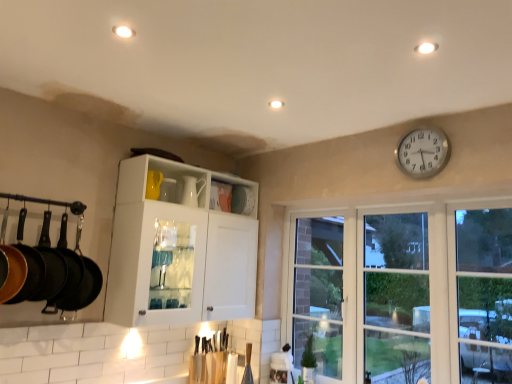
Question: Can you confirm if black cast iron frying pan at left, positioned as the first frying pan in back-to-front order, is thinner than matte black frying pan at left, which ranks as the 2th frying pan in back-to-front order?

Choices:
 (A) no
 (B) yes

Answer: (A)

Question: From the image's perspective, is black cast iron frying pan at left, positioned as the first frying pan in back-to-front order, on matte black frying pan at left, which ranks as the 2th frying pan in back-to-front order?

Choices:
 (A) no
 (B) yes

Answer: (A)

Question: From the image's perspective, is black cast iron frying pan at left, positioned as the 4th frying pan in front-to-back order, under matte black frying pan at left, the 3th frying pan viewed from the front?

Choices:
 (A) no
 (B) yes

Answer: (B)

Question: Would you say matte black frying pan at left, the 3th frying pan viewed from the front, is part of black cast iron frying pan at left, positioned as the 4th frying pan in front-to-back order,'s contents?

Choices:
 (A) yes
 (B) no

Answer: (B)

Question: Is black cast iron frying pan at left, positioned as the 4th frying pan in front-to-back order, facing towards matte black frying pan at left, which ranks as the 2th frying pan in back-to-front order?

Choices:
 (A) yes
 (B) no

Answer: (A)

Question: In terms of size, does transparent glass window at right appear bigger or smaller than matte black frying pan at left, which appears as the 3th frying pan when viewed from the back?

Choices:
 (A) big
 (B) small

Answer: (A)

Question: Does point (300, 258) appear closer or farther from the camera than point (26, 253)?

Choices:
 (A) closer
 (B) farther

Answer: (B)

Question: Considering the positions of transparent glass window at right and matte black frying pan at left, which appears as the 3th frying pan when viewed from the back, in the image, is transparent glass window at right wider or thinner than matte black frying pan at left, which appears as the 3th frying pan when viewed from the back,?

Choices:
 (A) wide
 (B) thin

Answer: (B)

Question: Based on their positions, is transparent glass window at right located to the left or right of matte black frying pan at left, which appears as the 3th frying pan when viewed from the back?

Choices:
 (A) right
 (B) left

Answer: (A)

Question: Considering the positions of matte black frying pan at left, the 3th frying pan viewed from the front, and black cast iron frying pan at left, positioned as the 4th frying pan in front-to-back order, in the image, is matte black frying pan at left, the 3th frying pan viewed from the front, taller or shorter than black cast iron frying pan at left, positioned as the 4th frying pan in front-to-back order,?

Choices:
 (A) tall
 (B) short

Answer: (B)

Question: Relative to black cast iron frying pan at left, positioned as the 4th frying pan in front-to-back order, is matte black frying pan at left, the 3th frying pan viewed from the front, in front or behind?

Choices:
 (A) front
 (B) behind

Answer: (A)

Question: Based on their sizes in the image, would you say matte black frying pan at left, which ranks as the 2th frying pan in back-to-front order, is bigger or smaller than black cast iron frying pan at left, positioned as the 4th frying pan in front-to-back order?

Choices:
 (A) small
 (B) big

Answer: (A)

Question: Is point (54, 249) closer or farther from the camera than point (75, 248)?

Choices:
 (A) closer
 (B) farther

Answer: (A)

Question: Considering the relative positions of white metallic clock at upper right and white glossy cabinet at center in the image provided, is white metallic clock at upper right to the left or to the right of white glossy cabinet at center?

Choices:
 (A) right
 (B) left

Answer: (A)

Question: Considering their positions, is white metallic clock at upper right located in front of or behind white glossy cabinet at center?

Choices:
 (A) front
 (B) behind

Answer: (A)